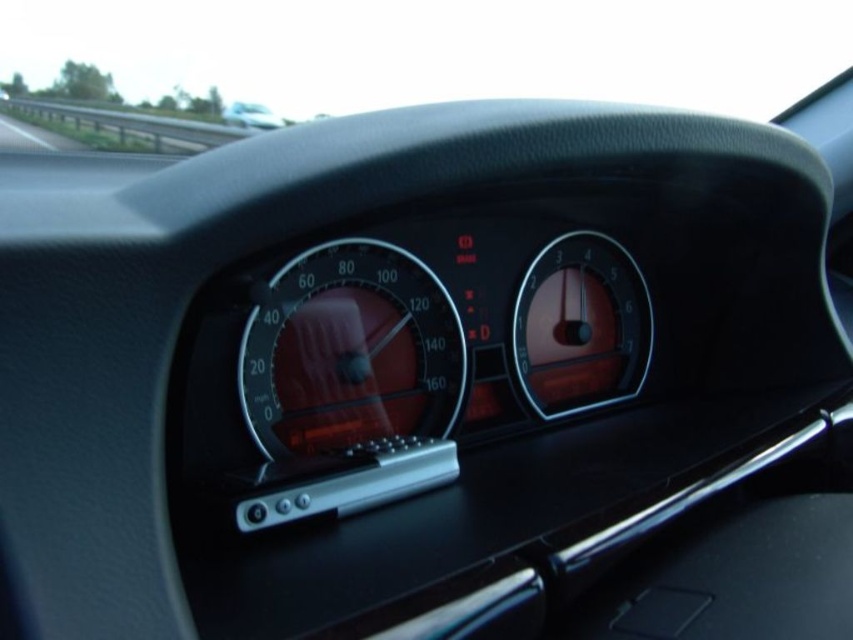
Which is in front, point (619, 376) or point (38, 100)?

Point (619, 376)

Can you confirm if matte black gauge at center is positioned to the left of metallic gray guardrail at upper left?

In fact, matte black gauge at center is to the right of metallic gray guardrail at upper left.

Between point (553, 330) and point (144, 124), which one is positioned in front?

Point (553, 330)

At what (x,y) coordinates should I click in order to perform the action: click on matte black gauge at center. Please return your answer as a coordinate pair (x, y). This screenshot has height=640, width=853. Looking at the image, I should click on (581, 324).

Is matte black gauge at center wider than matte black dashboard at center?

Yes, matte black gauge at center is wider than matte black dashboard at center.

Identify the location of matte black gauge at center. The image size is (853, 640). (581, 324).

Does glossy plastic speedometer at center have a larger size compared to matte black dashboard at center?

Yes, glossy plastic speedometer at center is bigger than matte black dashboard at center.

Who is more distant from viewer, (367, 417) or (257, 120)?

Point (257, 120)

Is point (263, 317) more distant than point (263, 125)?

No, it is in front of (263, 125).

This screenshot has height=640, width=853. What are the coordinates of `glossy plastic speedometer at center` in the screenshot? It's located at (349, 352).